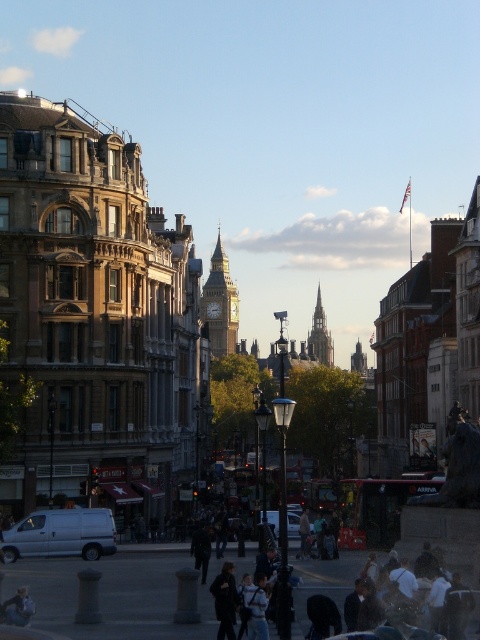
Who is positioned more to the left, white matte van at lower left or dark gray jacket at center?

From the viewer's perspective, white matte van at lower left appears more on the left side.

Is white matte van at lower left taller than dark gray jacket at center?

In fact, white matte van at lower left may be shorter than dark gray jacket at center.

Describe the element at coordinates (61, 534) in the screenshot. The width and height of the screenshot is (480, 640). I see `white matte van at lower left` at that location.

At what (x,y) coordinates should I click in order to perform the action: click on white matte van at lower left. Please return your answer as a coordinate pair (x, y). The width and height of the screenshot is (480, 640). Looking at the image, I should click on (61, 534).

Is white matte van at lower left bigger than dark gray stone spire at center?

Incorrect, white matte van at lower left is not larger than dark gray stone spire at center.

Does white matte van at lower left appear on the right side of dark gray stone spire at center?

In fact, white matte van at lower left is to the left of dark gray stone spire at center.

Is point (82, 550) closer to camera compared to point (319, 301)?

Yes, it is in front of point (319, 301).

This screenshot has width=480, height=640. In order to click on white matte van at lower left in this screenshot , I will do `click(61, 534)`.

Can you confirm if white cotton shirt at lower right is thinner than dark gray jacket at center?

No.

Who is more forward, [476,621] or [223,604]?

Point [223,604] is more forward.

Where is `white cotton shirt at lower right`? This screenshot has height=640, width=480. white cotton shirt at lower right is located at coordinates (433, 604).